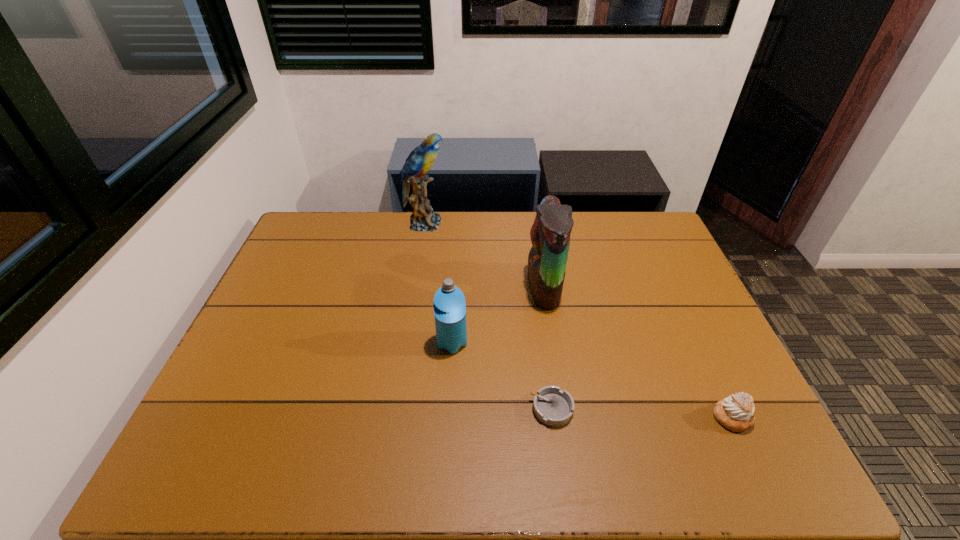
This screenshot has height=540, width=960. I want to click on empty space between the second shortest object and the third nearest object, so click(x=592, y=380).

Where is `empty location between the shortest object and the leftmost object`? empty location between the shortest object and the leftmost object is located at coordinates (488, 316).

Locate an element on the screen. This screenshot has width=960, height=540. empty space between the fourth tallest object and the farthest object is located at coordinates (578, 320).

Image resolution: width=960 pixels, height=540 pixels. What are the coordinates of `object that is the fourth nearest to the right parrot` in the screenshot? It's located at [x=736, y=412].

This screenshot has height=540, width=960. I want to click on the second closest object to the fourth tallest object, so click(550, 233).

The width and height of the screenshot is (960, 540). What are the coordinates of `free space that satisfies the following two spatial constraints: 1. on the face of the shortest object; 2. on the right side of the left parrot` in the screenshot? It's located at (395, 409).

What are the coordinates of `vacant space that satisfies the following two spatial constraints: 1. on the face of the leftmost object; 2. on the right side of the pastry` in the screenshot? It's located at (393, 417).

Image resolution: width=960 pixels, height=540 pixels. I want to click on vacant space that satisfies the following two spatial constraints: 1. on the face of the tallest object; 2. on the left side of the fourth tallest object, so click(393, 417).

Identify the location of vacant area that satisfies the following two spatial constraints: 1. on the face of the shortest object; 2. on the right side of the tallest object. The width and height of the screenshot is (960, 540). (395, 409).

Find the location of a particular element. The height and width of the screenshot is (540, 960). vacant space that satisfies the following two spatial constraints: 1. on the face of the left parrot; 2. on the right side of the pastry is located at coordinates (393, 417).